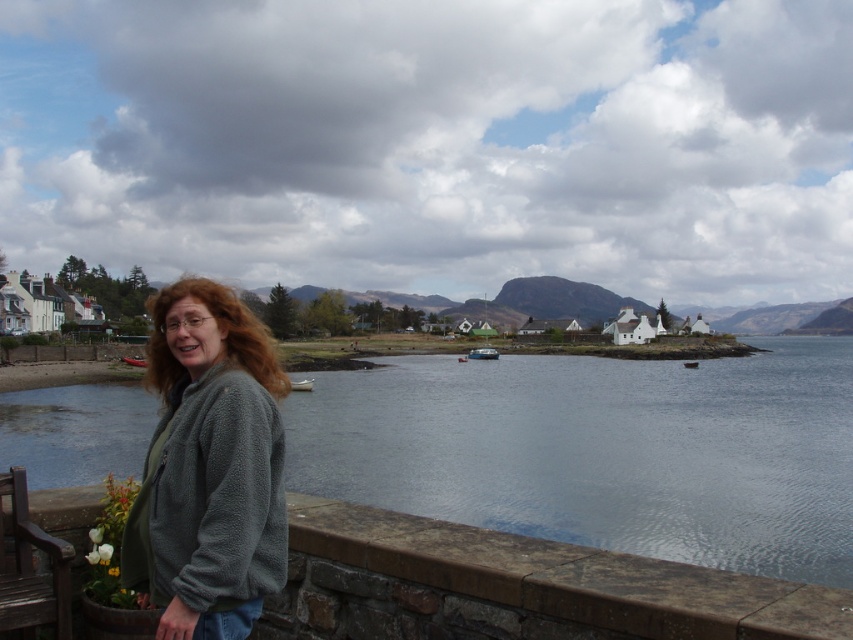
Is gray fleece jacket at lower left bigger than wooden park bench at lower left?

Yes.

Is point (186, 458) positioned before point (4, 579)?

Yes.

Where is `gray fleece jacket at lower left`? This screenshot has width=853, height=640. gray fleece jacket at lower left is located at coordinates (209, 468).

Is clear water at lower left wider than gray fleece jacket at lower left?

Indeed, clear water at lower left has a greater width compared to gray fleece jacket at lower left.

Between point (492, 504) and point (230, 560), which one is positioned in front?

Point (230, 560) is more forward.

Who is more distant from viewer, (572, 413) or (221, 484)?

The point (572, 413) is behind.

Find the location of a particular element. clear water at lower left is located at coordinates (602, 451).

Can you confirm if clear water at lower left is thinner than wooden park bench at lower left?

No.

Is clear water at lower left to the left of wooden park bench at lower left from the viewer's perspective?

No, clear water at lower left is not to the left of wooden park bench at lower left.

In order to click on clear water at lower left in this screenshot , I will do point(602,451).